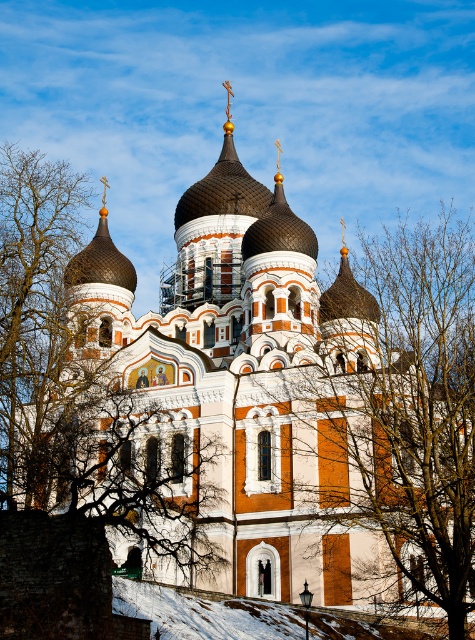
Question: Which point is closer to the camera?

Choices:
 (A) (418, 292)
 (B) (373, 580)
 (C) (85, 257)

Answer: (B)

Question: Can you confirm if white stone church at center is positioned above matte brown dome at upper left?

Choices:
 (A) no
 (B) yes

Answer: (A)

Question: Does bare branches at center have a lesser width compared to matte brown dome at upper left?

Choices:
 (A) yes
 (B) no

Answer: (B)

Question: Which object is the closest to the bare branches at center?

Choices:
 (A) brown leafless branches at center
 (B) matte brown dome at upper left
 (C) white stone church at center

Answer: (C)

Question: Does white stone church at center lie in front of bare branches at center?

Choices:
 (A) yes
 (B) no

Answer: (B)

Question: Which is nearer to the brown leafless branches at center?

Choices:
 (A) bare branches at center
 (B) matte brown dome at upper left
 (C) white stone church at center

Answer: (C)